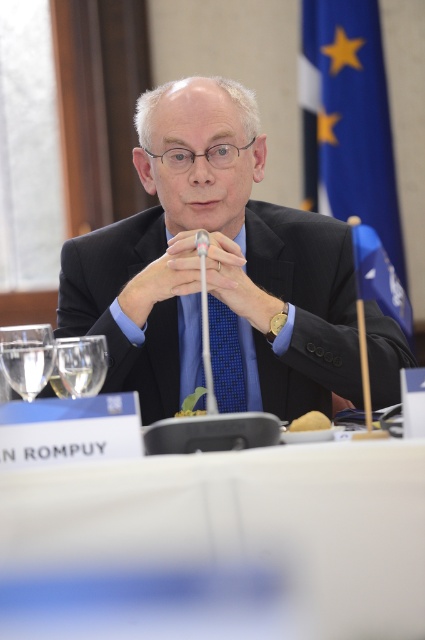
Is clear glass wine glass at lower left to the left of blue textured tie at center from the viewer's perspective?

Correct, you'll find clear glass wine glass at lower left to the left of blue textured tie at center.

Between clear glass wine glass at lower left and blue textured tie at center, which one has more height?

blue textured tie at center

Is point (27, 339) behind point (189, 387)?

No, it is not.

Find the location of a particular element. The height and width of the screenshot is (640, 425). clear glass wine glass at lower left is located at coordinates (27, 356).

Who is lower down, black glossy suit at center or clear glass wine glass at left?

Positioned lower is clear glass wine glass at left.

Image resolution: width=425 pixels, height=640 pixels. What do you see at coordinates (215, 269) in the screenshot?
I see `black glossy suit at center` at bounding box center [215, 269].

The width and height of the screenshot is (425, 640). What do you see at coordinates (215, 269) in the screenshot?
I see `black glossy suit at center` at bounding box center [215, 269].

Identify the location of black glossy suit at center. The image size is (425, 640). (215, 269).

Which is more to the right, black glossy suit at center or blue fabric flag at upper right?

Positioned to the right is blue fabric flag at upper right.

Looking at this image, does black glossy suit at center have a greater width compared to blue fabric flag at upper right?

Yes, black glossy suit at center is wider than blue fabric flag at upper right.

Between point (311, 278) and point (333, 77), which one is positioned behind?

Positioned behind is point (333, 77).

Where is `black glossy suit at center`? black glossy suit at center is located at coordinates (215, 269).